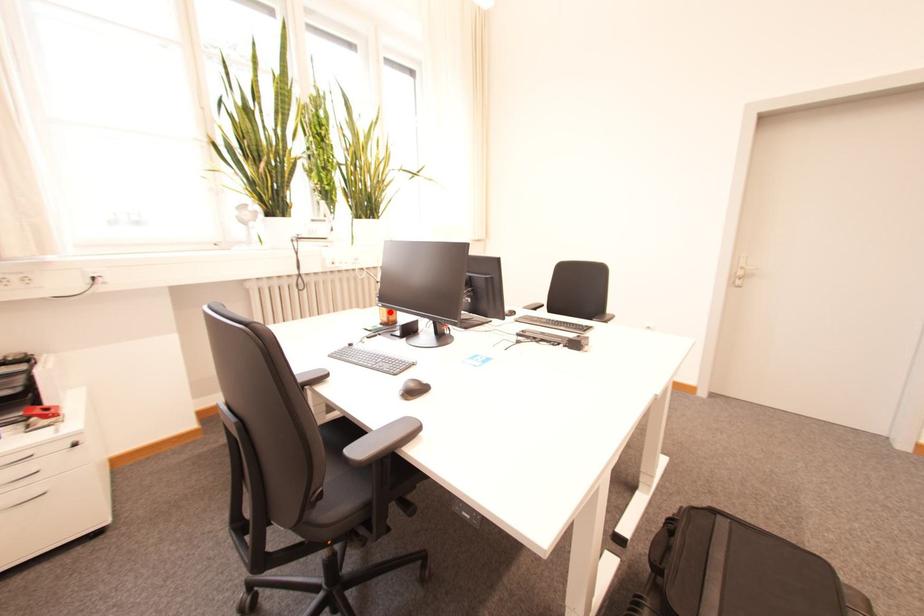
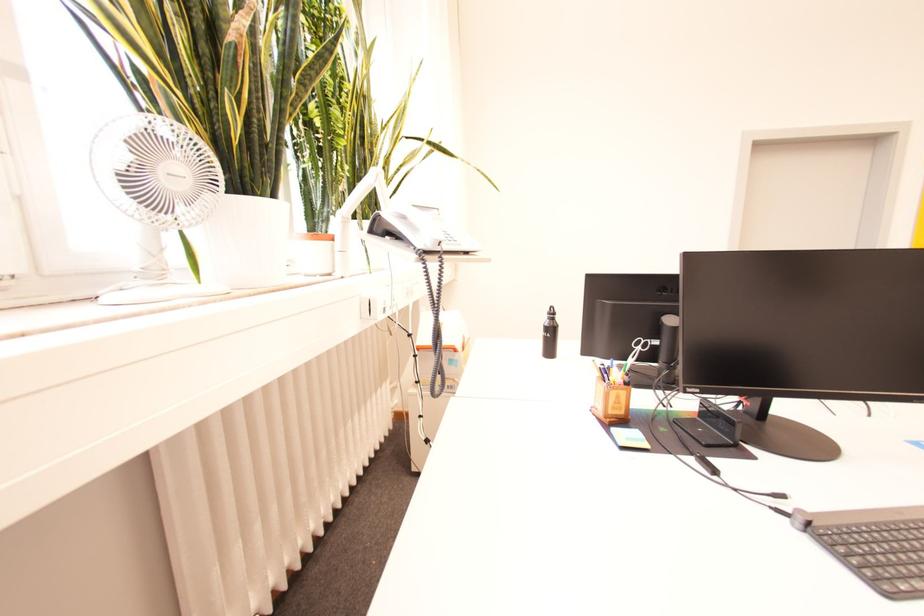
Locate, in the second image, the point that corresponds to the highlighted location in the first image.

(625, 398)